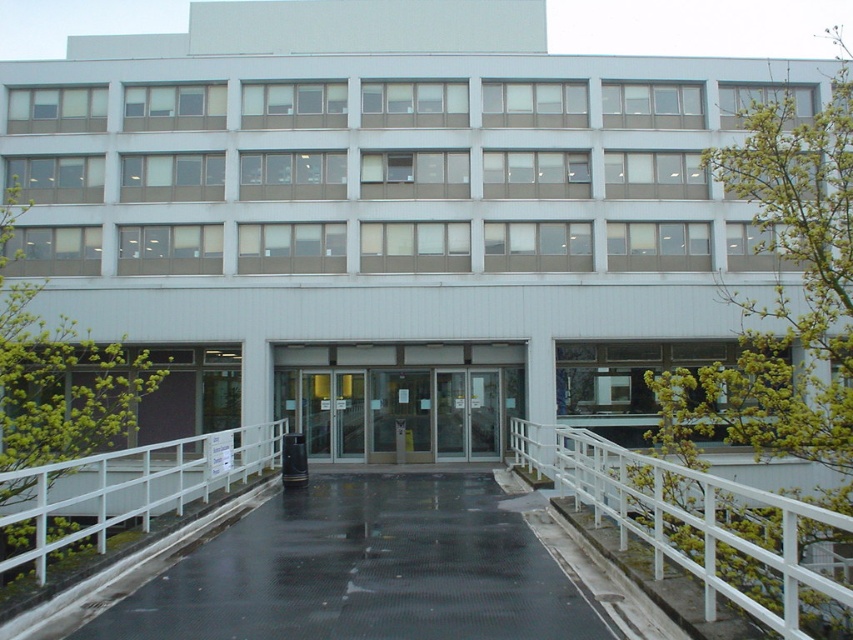
From the picture: Is black rubber path at center below white metal rail at lower left?

No.

Can you confirm if black rubber path at center is positioned to the left of white metal rail at lower left?

Incorrect, black rubber path at center is not on the left side of white metal rail at lower left.

Does point (538, 618) come behind point (183, 449)?

No.

Find the location of a particular element. black rubber path at center is located at coordinates (364, 570).

Who is more distant from viewer, (693, 566) or (74, 509)?

Positioned behind is point (74, 509).

Based on the photo, is white metal railing at center positioned in front of white metal rail at lower left?

Yes, white metal railing at center is in front of white metal rail at lower left.

Describe the element at coordinates (703, 525) in the screenshot. The height and width of the screenshot is (640, 853). I see `white metal railing at center` at that location.

Find the location of a particular element. white metal railing at center is located at coordinates (703, 525).

Is white metal railing at center positioned before transparent glass doors at center?

That is True.

Is white metal railing at center behind transparent glass doors at center?

No, white metal railing at center is closer to the viewer.

The image size is (853, 640). What do you see at coordinates (703, 525) in the screenshot?
I see `white metal railing at center` at bounding box center [703, 525].

The height and width of the screenshot is (640, 853). Identify the location of white metal railing at center. pos(703,525).